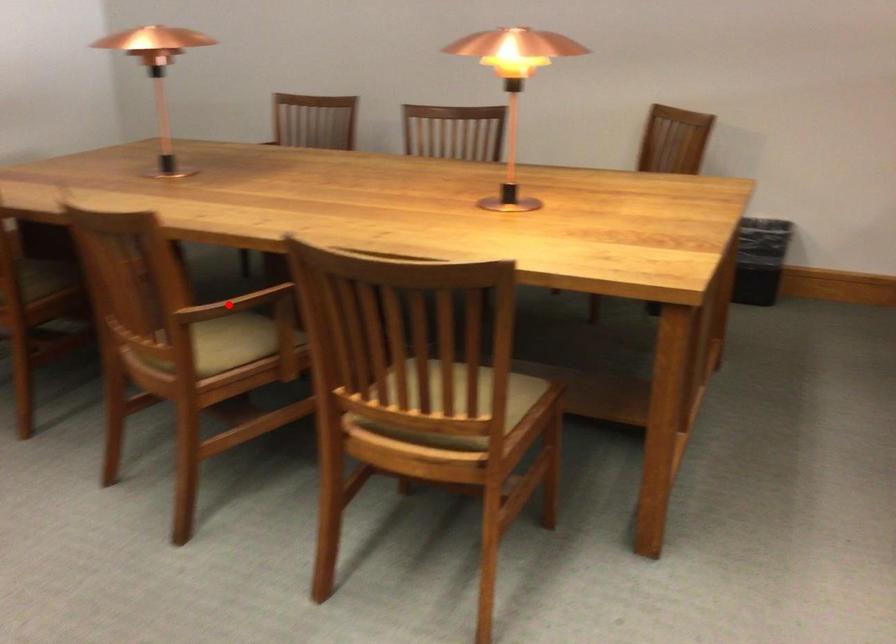
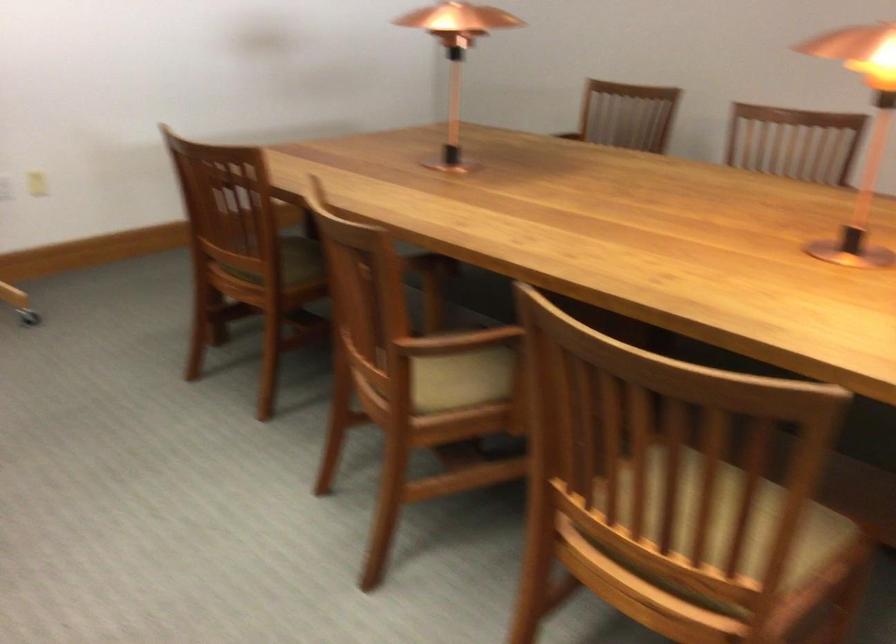
In the second image, find the point that corresponds to the highlighted location in the first image.

(455, 342)